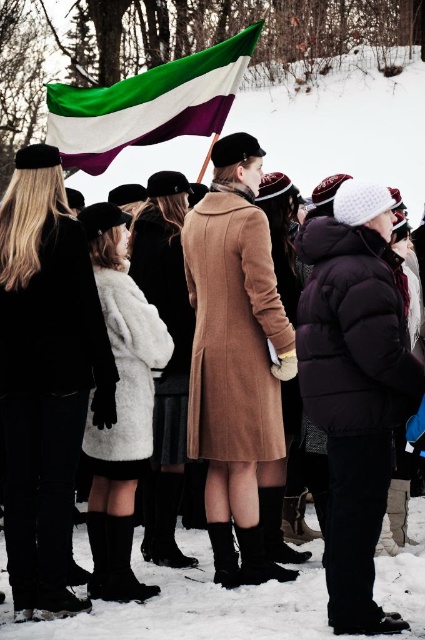
Question: Which point is farther from the camera taking this photo?

Choices:
 (A) (124, 282)
 (B) (235, 77)

Answer: (B)

Question: Which point is closer to the camera?

Choices:
 (A) 124,524
 (B) 209,392
 (C) 351,404
 (D) 104,160

Answer: (C)

Question: Does matte black coat at center appear over green and white fabric flag at upper center?

Choices:
 (A) yes
 (B) no

Answer: (B)

Question: Estimate the real-world distances between objects in this image. Which object is closer to the suede tan coat at center?

Choices:
 (A) matte black coat at center
 (B) black fur coat at left
 (C) fuzzy white coat at center
 (D) green and white fabric flag at upper center

Answer: (A)

Question: Can you confirm if black fur coat at left is positioned below matte black coat at center?

Choices:
 (A) yes
 (B) no

Answer: (A)

Question: Does black fur coat at left have a greater width compared to green and white fabric flag at upper center?

Choices:
 (A) yes
 (B) no

Answer: (B)